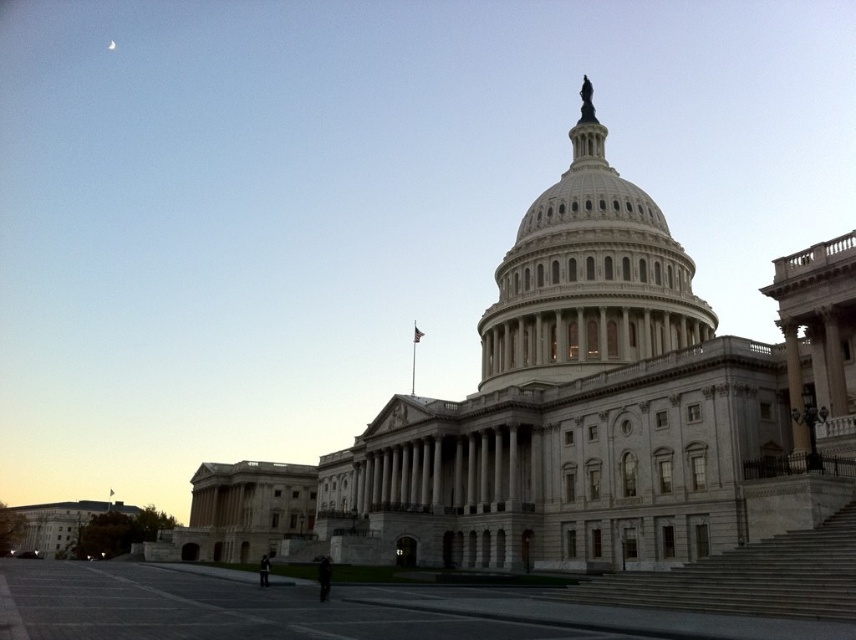
You are standing at the point marked as point (587, 276) in the image. What object is located exactly at your current position?

The white marble dome at center is located exactly at point (587, 276).

You are standing on the gray stone stairs at lower right and want to walk towards the white marble dome at center. Which direction should you move relative to your current position?

Since the white marble dome at center is closer to you than the gray stone stairs at lower right, you should move forward towards the white marble dome at center.

You are a tourist standing at the edge of the plaza looking towards the United States Capitol. You notice the white marble dome at center and the gray stone stairs at lower right. Which object appears taller from your vantage point?

The white marble dome at center appears taller than the gray stone stairs at lower right from your vantage point.